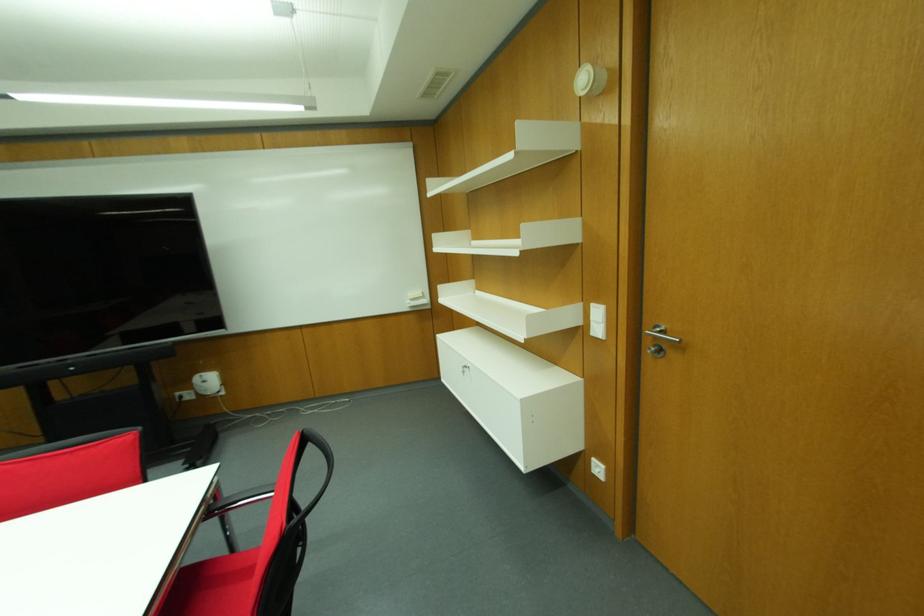
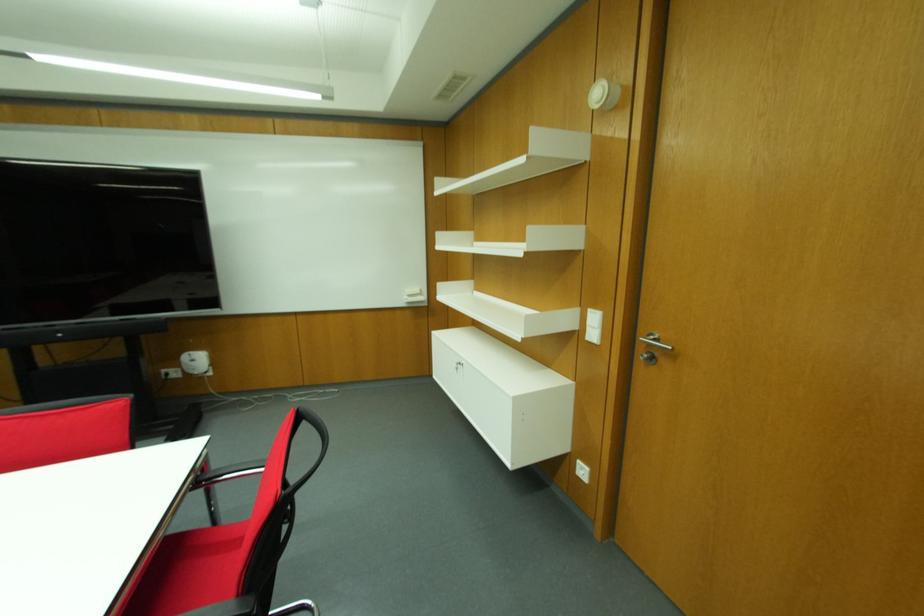
Locate, in the second image, the point that corresponds to point (660, 331) in the first image.

(652, 339)